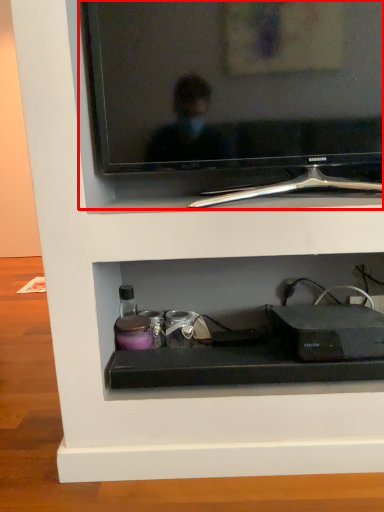
Question: Considering the relative positions of television (annotated by the red box) and gadget in the image provided, where is television (annotated by the red box) located with respect to the staircase?

Choices:
 (A) right
 (B) left

Answer: (B)